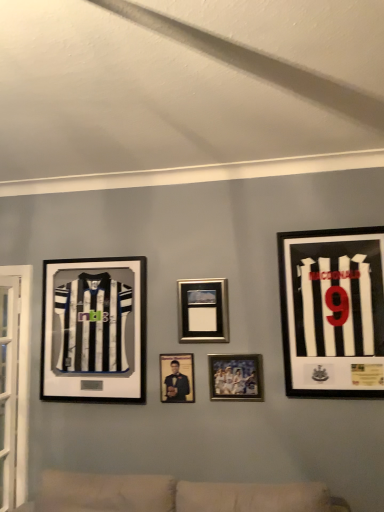
Question: In terms of size, does black matte jersey at left, the 1th picture frame positioned from the left, appear bigger or smaller than matte black photo frame at center, the fourth picture frame when ordered from right to left?

Choices:
 (A) big
 (B) small

Answer: (A)

Question: From their relative heights in the image, would you say black matte jersey at left, placed as the fifth picture frame when sorted from right to left, is taller or shorter than matte black photo frame at center, the second picture frame viewed from the left?

Choices:
 (A) tall
 (B) short

Answer: (A)

Question: Which is farther from the metallic silver photo frame at center, marked as the second picture frame in a right-to-left arrangement?

Choices:
 (A) black matte jersey at right, acting as the fifth picture frame starting from the left
 (B) metallic silver photo frame at center, acting as the third picture frame starting from the right
 (C) matte black photo frame at center, the fourth picture frame when ordered from right to left
 (D) black matte jersey at left, the 1th picture frame positioned from the left

Answer: (D)

Question: Which of these objects is positioned closest to the black matte jersey at right, acting as the fifth picture frame starting from the left?

Choices:
 (A) metallic silver photo frame at center, marked as the second picture frame in a right-to-left arrangement
 (B) black matte jersey at left, the 1th picture frame positioned from the left
 (C) metallic silver photo frame at center, which appears as the 3th picture frame when viewed from the left
 (D) matte black photo frame at center, the second picture frame viewed from the left

Answer: (A)